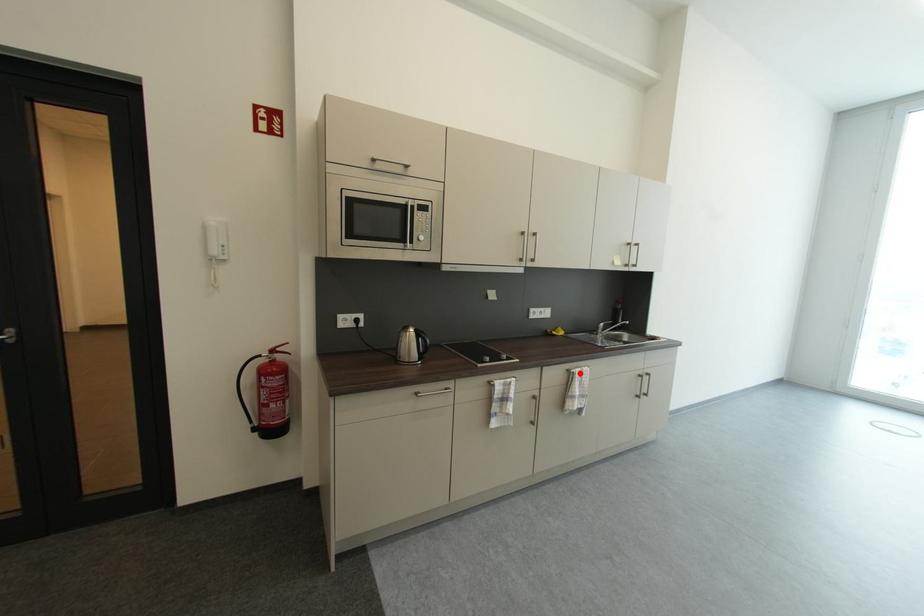
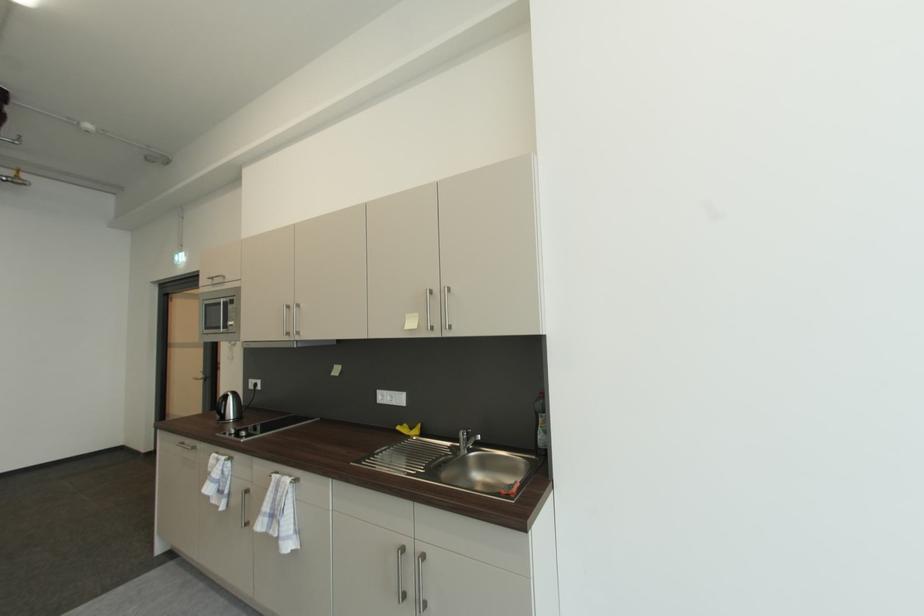
The point at the highlighted location is marked in the first image. Where is the corresponding point in the second image?

(277, 477)